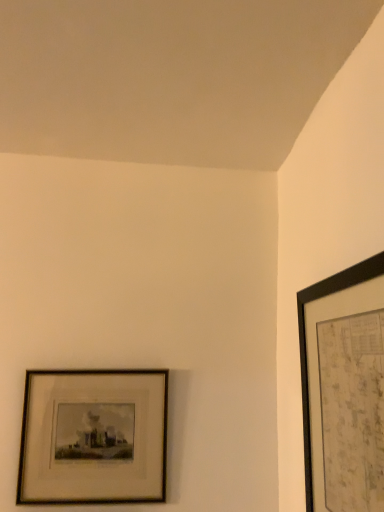
Question: Considering the positions of black matte picture frame at upper right, arranged as the 1th picture frame when viewed from the right, and wooden framed print at lower left, acting as the second picture frame starting from the front, in the image, is black matte picture frame at upper right, arranged as the 1th picture frame when viewed from the right, wider or thinner than wooden framed print at lower left, acting as the second picture frame starting from the front,?

Choices:
 (A) thin
 (B) wide

Answer: (B)

Question: From a real-world perspective, relative to wooden framed print at lower left, placed as the 1th picture frame when sorted from back to front, is black matte picture frame at upper right, arranged as the 1th picture frame when viewed from the right, vertically above or below?

Choices:
 (A) below
 (B) above

Answer: (B)

Question: From the image's perspective, is black matte picture frame at upper right, the second picture frame viewed from the back, located above or below wooden framed print at lower left, placed as the 1th picture frame when sorted from back to front?

Choices:
 (A) above
 (B) below

Answer: (A)

Question: Is wooden framed print at lower left, the second picture frame positioned from the right, to the left or to the right of black matte picture frame at upper right, the second picture frame viewed from the back, in the image?

Choices:
 (A) right
 (B) left

Answer: (B)

Question: Considering the positions of wooden framed print at lower left, the second picture frame positioned from the right, and black matte picture frame at upper right, which appears as the 1th picture frame when viewed from the front, in the image, is wooden framed print at lower left, the second picture frame positioned from the right, wider or thinner than black matte picture frame at upper right, which appears as the 1th picture frame when viewed from the front,?

Choices:
 (A) wide
 (B) thin

Answer: (B)

Question: From a real-world perspective, is wooden framed print at lower left, acting as the second picture frame starting from the front, physically located above or below black matte picture frame at upper right, arranged as the 1th picture frame when viewed from the right?

Choices:
 (A) below
 (B) above

Answer: (A)

Question: From their relative heights in the image, would you say wooden framed print at lower left, which is the first picture frame in left-to-right order, is taller or shorter than black matte picture frame at upper right, which appears as the 1th picture frame when viewed from the front?

Choices:
 (A) short
 (B) tall

Answer: (A)